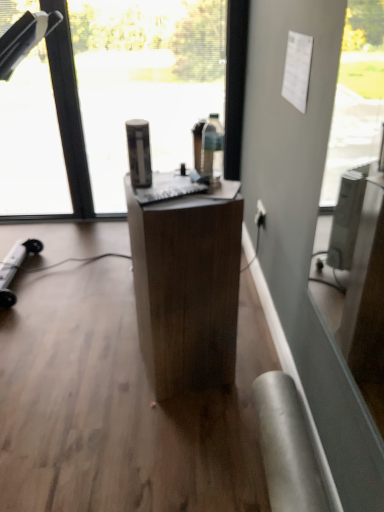
Find the location of a particular element. white plastic power outlet at lower right is located at coordinates (260, 214).

Can you confirm if transparent glass window at center is positioned to the right of white plastic power outlet at lower right?

Incorrect, transparent glass window at center is not on the right side of white plastic power outlet at lower right.

There is a white plastic power outlet at lower right. Identify the location of window above it (from a real-world perspective). (117, 100).

From a real-world perspective, which is physically above, transparent glass window at center or white plastic power outlet at lower right?

transparent glass window at center, from a real-world perspective.

Measure the distance between transparent glass window at center and white plastic power outlet at lower right.

1.11 meters.

Would you say transparent glass window at center is inside or outside wooden desk at center?

transparent glass window at center is not enclosed by wooden desk at center.

What are the coordinates of `window behind the wooden desk at center` in the screenshot? It's located at (117, 100).

Could you tell me if transparent glass window at center is turned towards wooden desk at center?

Yes, transparent glass window at center is turned towards wooden desk at center.

From a real-world perspective, is white plastic power outlet at lower right beneath wooden desk at center?

Yes.

How distant is white plastic power outlet at lower right from wooden desk at center?

33.26 inches.

Between white plastic power outlet at lower right and wooden desk at center, which one appears on the right side from the viewer's perspective?

From the viewer's perspective, white plastic power outlet at lower right appears more on the right side.

Image resolution: width=384 pixels, height=512 pixels. I want to click on power outlet below the wooden desk at center (from a real-world perspective), so click(260, 214).

From a real-world perspective, relative to transparent glass window at center, is white plastic power outlet at lower right vertically above or below?

In terms of real-world spatial position, white plastic power outlet at lower right is below transparent glass window at center.

Based on the photo, is white plastic power outlet at lower right turned away from transparent glass window at center?

That's not correct — white plastic power outlet at lower right is not looking away from transparent glass window at center.

Is white plastic power outlet at lower right thinner than transparent glass window at center?

Yes, white plastic power outlet at lower right is thinner than transparent glass window at center.

Considering the sizes of white plastic power outlet at lower right and transparent glass window at center in the image, is white plastic power outlet at lower right taller or shorter than transparent glass window at center?

Clearly, white plastic power outlet at lower right is shorter compared to transparent glass window at center.

Is wooden desk at center positioned behind white plastic power outlet at lower right?

No, it is not.

Is there a large distance between wooden desk at center and white plastic power outlet at lower right?

They are positioned close to each other.

Looking at their sizes, would you say wooden desk at center is wider or thinner than white plastic power outlet at lower right?

wooden desk at center is wider than white plastic power outlet at lower right.

Is wooden desk at center to the left of white plastic power outlet at lower right from the viewer's perspective?

Indeed, wooden desk at center is positioned on the left side of white plastic power outlet at lower right.

Considering the relative sizes of wooden desk at center and transparent glass window at center in the image provided, is wooden desk at center bigger than transparent glass window at center?

No.

Are wooden desk at center and transparent glass window at center making contact?

There is a gap between wooden desk at center and transparent glass window at center.

From a real-world perspective, which object stands above the other?

transparent glass window at center, from a real-world perspective.

Which object is closer to the camera taking this photo, wooden desk at center or transparent glass window at center?

wooden desk at center is closer to the camera.

The width and height of the screenshot is (384, 512). What are the coordinates of `power outlet behind the transparent glass window at center` in the screenshot? It's located at (260, 214).

I want to click on desk in front of the transparent glass window at center, so pyautogui.click(x=186, y=289).

When comparing their distances from transparent glass window at center, does white plastic power outlet at lower right or wooden desk at center seem closer?

Based on the image, white plastic power outlet at lower right appears to be nearer to transparent glass window at center.

Considering their positions, is white plastic power outlet at lower right positioned closer to wooden desk at center than transparent glass window at center?

white plastic power outlet at lower right is closer to wooden desk at center.

Based on their spatial positions, is wooden desk at center or transparent glass window at center further from white plastic power outlet at lower right?

transparent glass window at center is further to white plastic power outlet at lower right.

From the image, which object appears to be nearer to transparent glass window at center, wooden desk at center or white plastic power outlet at lower right?

The object closer to transparent glass window at center is white plastic power outlet at lower right.

Estimate the real-world distances between objects in this image. Which object is closer to wooden desk at center, transparent glass window at center or white plastic power outlet at lower right?

The object closer to wooden desk at center is white plastic power outlet at lower right.

Which object lies nearer to the anchor point white plastic power outlet at lower right, transparent glass window at center or wooden desk at center?

wooden desk at center lies closer to white plastic power outlet at lower right than the other object.

Identify the location of window between wooden desk at center and white plastic power outlet at lower right along the z-axis. The height and width of the screenshot is (512, 384). (117, 100).